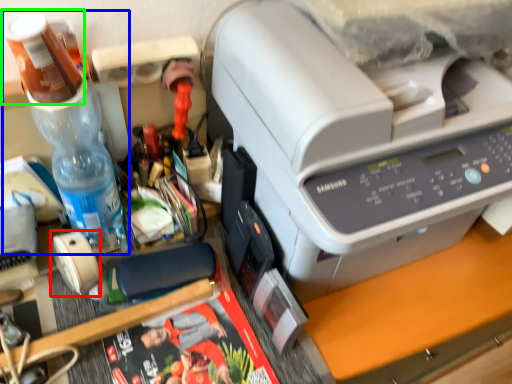
Question: Which object is positioned farthest from tape (highlighted by a red box)? Select from bottle (highlighted by a blue box) and stationery (highlighted by a green box).

Choices:
 (A) bottle
 (B) stationery

Answer: (B)